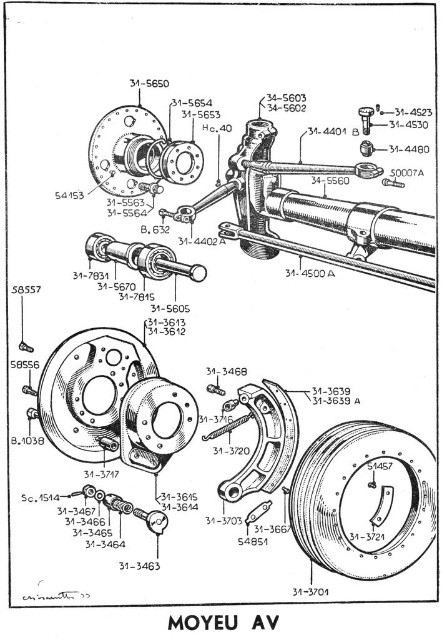
Question: Does matte black telescope at center appear on the left side of matte silver rod at center?

Choices:
 (A) no
 (B) yes

Answer: (A)

Question: Which of the following is the closest to the observer?

Choices:
 (A) (248, 248)
 (B) (143, 244)

Answer: (B)

Question: Is matte black telescope at center above matte silver rod at center?

Choices:
 (A) yes
 (B) no

Answer: (A)

Question: Which point is closer to the camera?

Choices:
 (A) (138, 272)
 (B) (243, 221)

Answer: (A)

Question: Is matte black telescope at center bigger than matte silver rod at center?

Choices:
 (A) yes
 (B) no

Answer: (A)

Question: Among these points, which one is farthest from the camera?

Choices:
 (A) (275, 189)
 (B) (164, 272)

Answer: (A)